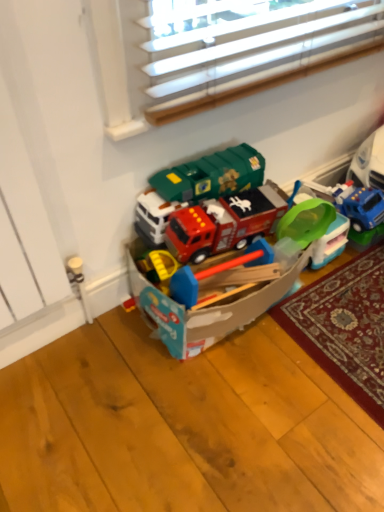
Image resolution: width=384 pixels, height=512 pixels. Identify the location of vacant area that lies in front of translucent plastic bucket at center, which is the 1th toy from right to left. (327, 290).